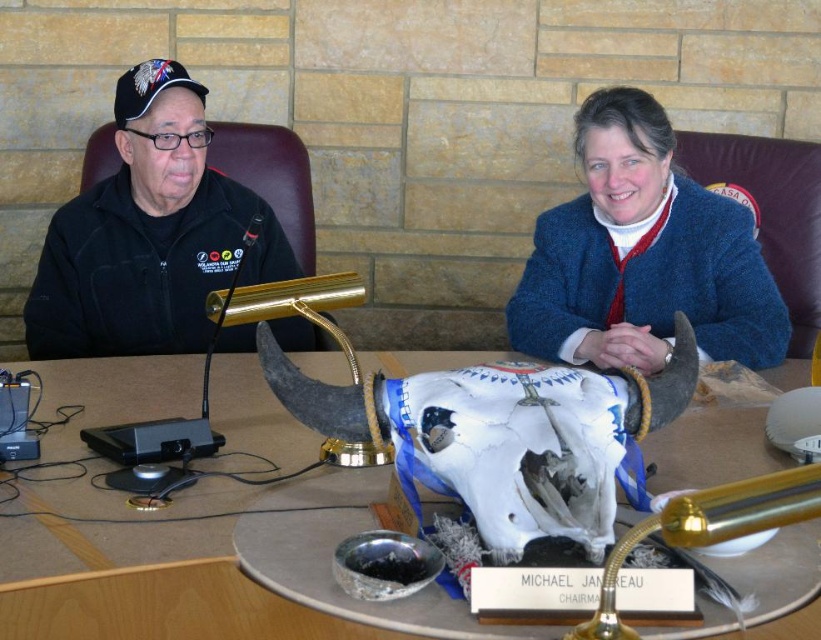
Can you confirm if wooden table at center is thinner than black fleece jacket at left?

Incorrect, wooden table at center's width is not less than black fleece jacket at left's.

From the picture: Can you confirm if wooden table at center is smaller than black fleece jacket at left?

No.

Find the location of `wooden table at center`. wooden table at center is located at coordinates (148, 586).

Identify the location of wooden table at center. (148, 586).

Which of these two, wooden table at center or blue woolen sweater at upper right, stands shorter?

Standing shorter between the two is wooden table at center.

Between point (109, 577) and point (581, 104), which one is positioned in front?

Point (109, 577) is in front.

Locate an element on the screen. This screenshot has width=821, height=640. wooden table at center is located at coordinates (148, 586).

Between blue woolen sweater at upper right and black fleece jacket at left, which one appears on the right side from the viewer's perspective?

blue woolen sweater at upper right

Which is below, blue woolen sweater at upper right or black fleece jacket at left?

Positioned lower is blue woolen sweater at upper right.

Between point (583, 157) and point (255, 272), which one is positioned behind?

The point (255, 272) is more distant.

Where is `blue woolen sweater at upper right`? The image size is (821, 640). blue woolen sweater at upper right is located at coordinates (641, 256).